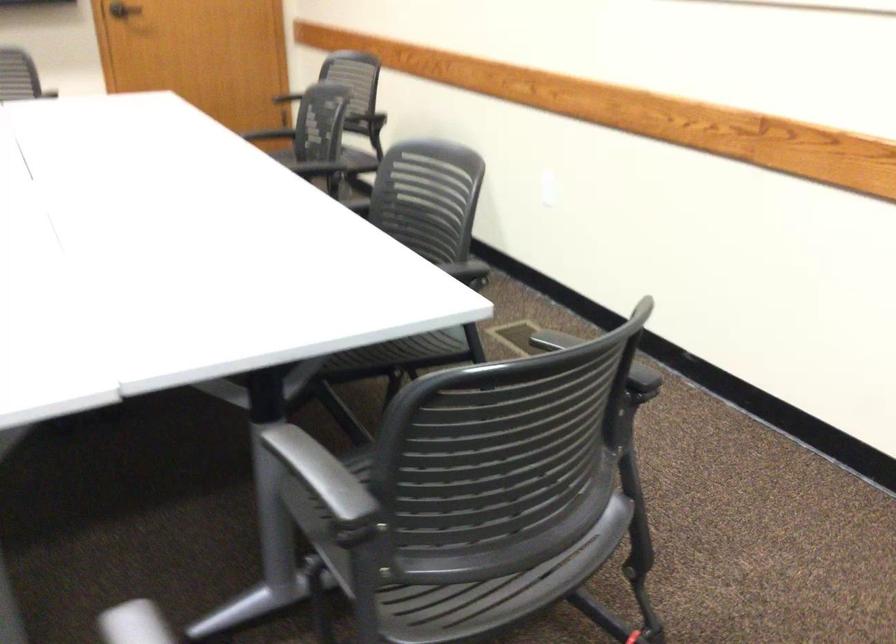
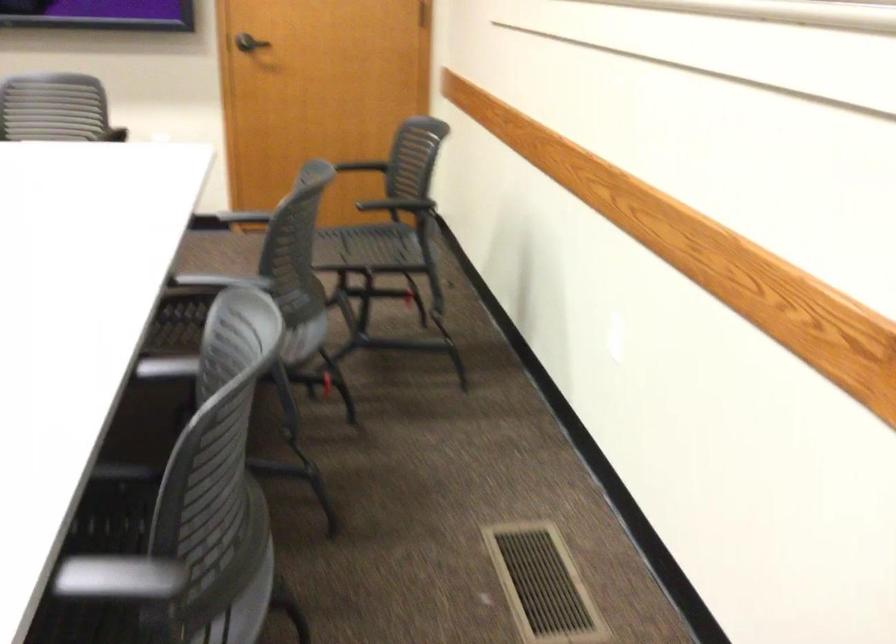
The point at [383,164] is marked in the first image. Where is the corresponding point in the second image?

(225, 319)